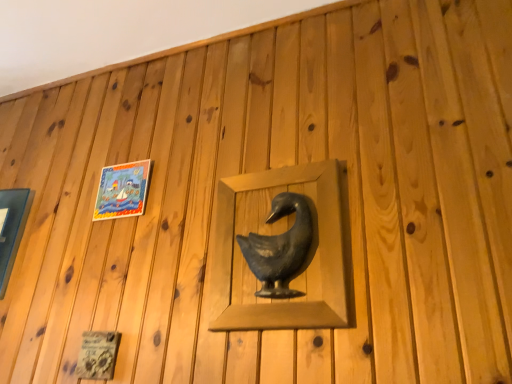
Question: Is matte glass picture frame at left, marked as the first picture frame in a left-to-right arrangement, at the left side of matte plastic picture frame at upper left, placed as the 1th picture frame when sorted from right to left?

Choices:
 (A) yes
 (B) no

Answer: (A)

Question: Is matte glass picture frame at left, which is counted as the 2th picture frame, starting from the right, turned away from matte plastic picture frame at upper left, the 2th picture frame when ordered from left to right?

Choices:
 (A) no
 (B) yes

Answer: (A)

Question: Considering the relative positions of matte glass picture frame at left, which is counted as the 2th picture frame, starting from the right, and matte plastic picture frame at upper left, placed as the 1th picture frame when sorted from right to left, in the image provided, is matte glass picture frame at left, which is counted as the 2th picture frame, starting from the right, in front of matte plastic picture frame at upper left, placed as the 1th picture frame when sorted from right to left,?

Choices:
 (A) yes
 (B) no

Answer: (B)

Question: Is matte glass picture frame at left, marked as the first picture frame in a left-to-right arrangement, aimed at matte plastic picture frame at upper left, the 2th picture frame when ordered from left to right?

Choices:
 (A) yes
 (B) no

Answer: (B)

Question: Would you consider matte glass picture frame at left, which is counted as the 2th picture frame, starting from the right, to be distant from matte plastic picture frame at upper left, placed as the 1th picture frame when sorted from right to left?

Choices:
 (A) yes
 (B) no

Answer: (B)

Question: Is point (19, 192) closer or farther from the camera than point (129, 180)?

Choices:
 (A) closer
 (B) farther

Answer: (B)

Question: Would you say matte glass picture frame at left, marked as the first picture frame in a left-to-right arrangement, is to the left or to the right of matte plastic picture frame at upper left, the 2th picture frame when ordered from left to right, in the picture?

Choices:
 (A) right
 (B) left

Answer: (B)

Question: From the image's perspective, is matte glass picture frame at left, marked as the first picture frame in a left-to-right arrangement, above or below matte plastic picture frame at upper left, the 2th picture frame when ordered from left to right?

Choices:
 (A) below
 (B) above

Answer: (A)

Question: Looking at their shapes, would you say matte glass picture frame at left, marked as the first picture frame in a left-to-right arrangement, is wider or thinner than matte plastic picture frame at upper left, the 2th picture frame when ordered from left to right?

Choices:
 (A) thin
 (B) wide

Answer: (B)

Question: Considering the positions of matte plastic picture frame at upper left, placed as the 1th picture frame when sorted from right to left, and matte glass picture frame at left, which is counted as the 2th picture frame, starting from the right, in the image, is matte plastic picture frame at upper left, placed as the 1th picture frame when sorted from right to left, taller or shorter than matte glass picture frame at left, which is counted as the 2th picture frame, starting from the right,?

Choices:
 (A) short
 (B) tall

Answer: (A)

Question: Is matte plastic picture frame at upper left, placed as the 1th picture frame when sorted from right to left, in front of or behind matte glass picture frame at left, marked as the first picture frame in a left-to-right arrangement, in the image?

Choices:
 (A) behind
 (B) front

Answer: (B)

Question: Is point (135, 173) closer or farther from the camera than point (12, 256)?

Choices:
 (A) farther
 (B) closer

Answer: (B)

Question: From a real-world perspective, relative to matte glass picture frame at left, marked as the first picture frame in a left-to-right arrangement, is matte plastic picture frame at upper left, placed as the 1th picture frame when sorted from right to left, vertically above or below?

Choices:
 (A) above
 (B) below

Answer: (A)

Question: In terms of width, does matte black duck at center look wider or thinner when compared to matte plastic picture frame at upper left, placed as the 1th picture frame when sorted from right to left?

Choices:
 (A) wide
 (B) thin

Answer: (A)

Question: Based on their sizes in the image, would you say matte black duck at center is bigger or smaller than matte plastic picture frame at upper left, placed as the 1th picture frame when sorted from right to left?

Choices:
 (A) small
 (B) big

Answer: (B)